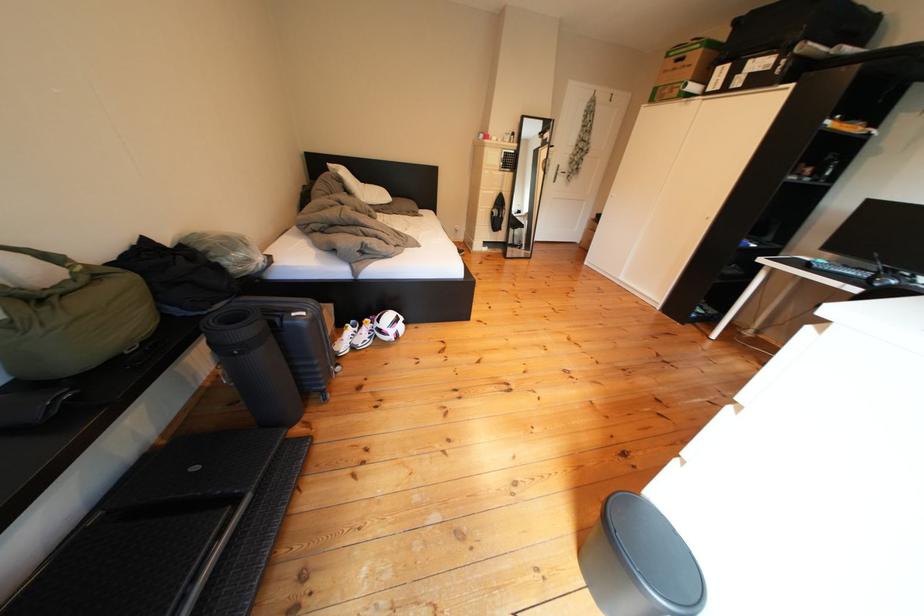
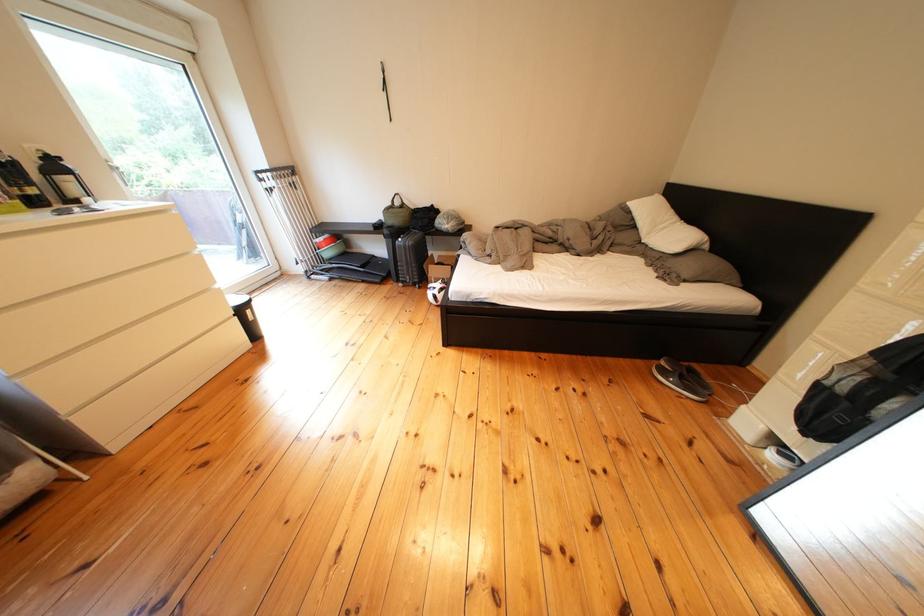
Find the pixel in the second image that matches the point at 361,197 in the first image.

(649, 230)